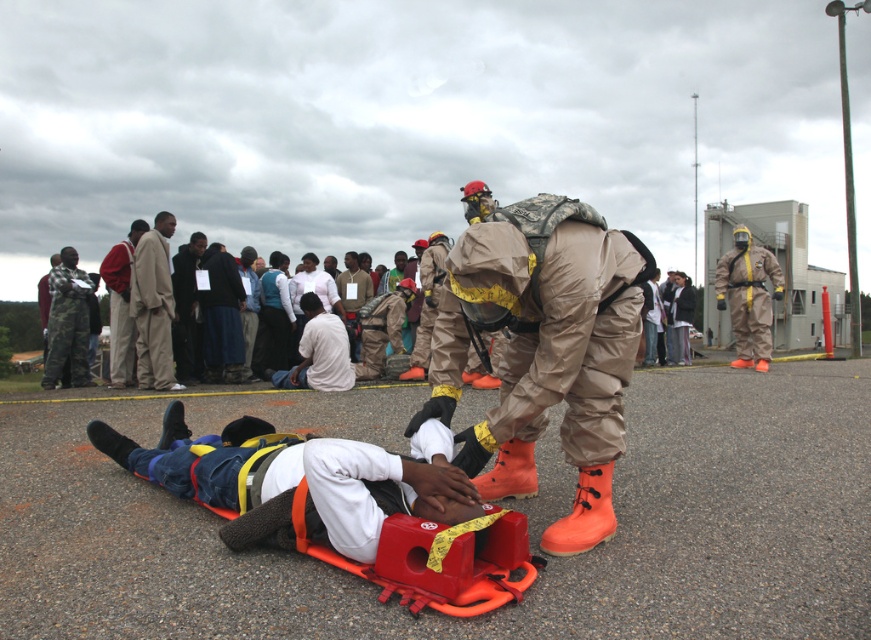
Does beige cotton suit at center have a larger size compared to matte khaki hazmat suit at right?

No, beige cotton suit at center is not bigger than matte khaki hazmat suit at right.

Is point (140, 333) positioned after point (754, 364)?

No.

Who is more forward, (144, 340) or (736, 307)?

Point (144, 340)

This screenshot has width=871, height=640. I want to click on beige cotton suit at center, so click(x=153, y=305).

Does denim pants at center appear on the left side of matte khaki hazmat suit at right?

Yes, denim pants at center is to the left of matte khaki hazmat suit at right.

Between point (172, 420) and point (760, 305), which one is positioned in front?

Point (172, 420) is in front.

Which is behind, point (319, 532) or point (743, 243)?

The point (743, 243) is more distant.

Where is `denim pants at center`? The height and width of the screenshot is (640, 871). denim pants at center is located at coordinates (302, 476).

Which is behind, point (528, 426) or point (768, 324)?

The point (768, 324) is behind.

Which is more to the right, camouflage fabric hazmat suit at center or matte khaki hazmat suit at right?

matte khaki hazmat suit at right is more to the right.

Is point (505, 483) less distant than point (734, 230)?

Yes, it is in front of point (734, 230).

Identify the location of camouflage fabric hazmat suit at center. (547, 348).